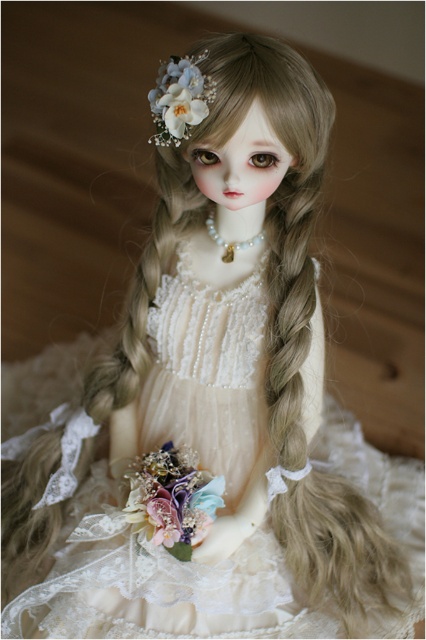
Who is lower down, floral bouquet at center or white floral hair accessory at upper left?

floral bouquet at center

Does floral bouquet at center appear over white floral hair accessory at upper left?

Actually, floral bouquet at center is below white floral hair accessory at upper left.

This screenshot has height=640, width=426. What do you see at coordinates (172, 499) in the screenshot?
I see `floral bouquet at center` at bounding box center [172, 499].

Identify the location of floral bouquet at center. (172, 499).